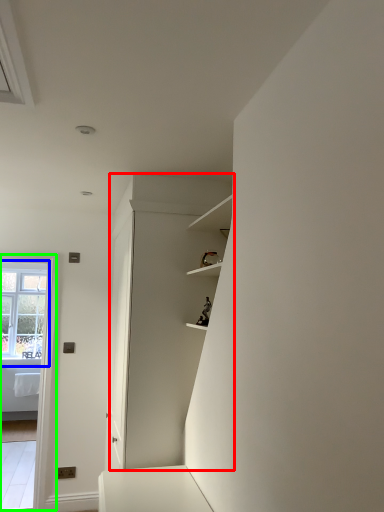
Question: Which object is positioned closest to dresser (highlighted by a red box)? Select from window (highlighted by a blue box) and glass door (highlighted by a green box).

Choices:
 (A) window
 (B) glass door

Answer: (B)